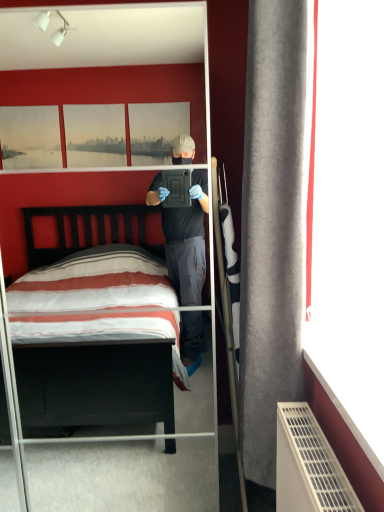
Question: Considering the positions of clear glass mirror at center and gray fabric curtain at right in the image, is clear glass mirror at center taller or shorter than gray fabric curtain at right?

Choices:
 (A) short
 (B) tall

Answer: (B)

Question: Considering their positions, is clear glass mirror at center located in front of or behind gray fabric curtain at right?

Choices:
 (A) front
 (B) behind

Answer: (B)

Question: In terms of width, does clear glass mirror at center look wider or thinner when compared to gray fabric curtain at right?

Choices:
 (A) thin
 (B) wide

Answer: (B)

Question: Is point (254, 412) closer or farther from the camera than point (188, 423)?

Choices:
 (A) closer
 (B) farther

Answer: (A)

Question: Is gray fabric curtain at right wider or thinner than clear glass mirror at center?

Choices:
 (A) wide
 (B) thin

Answer: (B)

Question: Would you say gray fabric curtain at right is to the left or to the right of clear glass mirror at center in the picture?

Choices:
 (A) right
 (B) left

Answer: (A)

Question: Considering the positions of gray fabric curtain at right and clear glass mirror at center in the image, is gray fabric curtain at right taller or shorter than clear glass mirror at center?

Choices:
 (A) tall
 (B) short

Answer: (B)